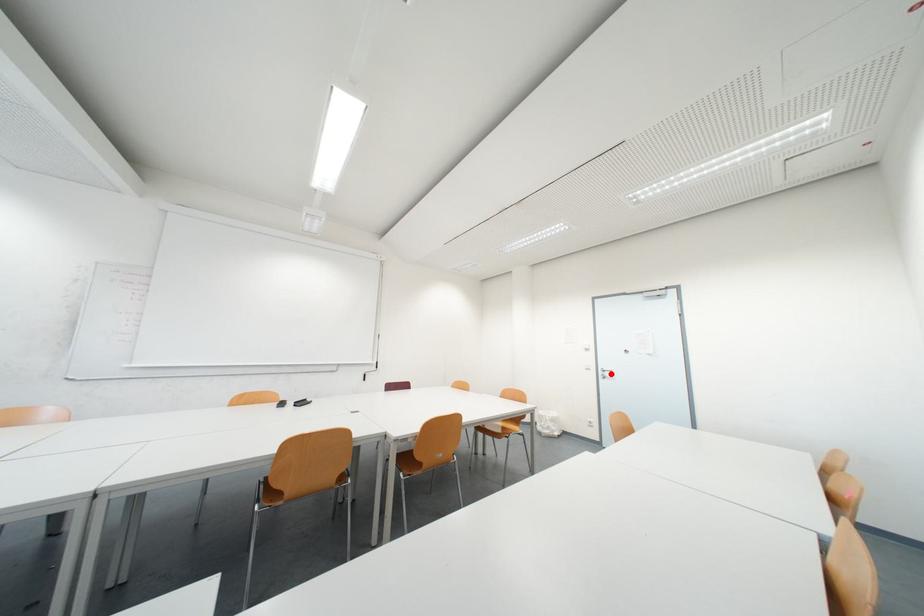
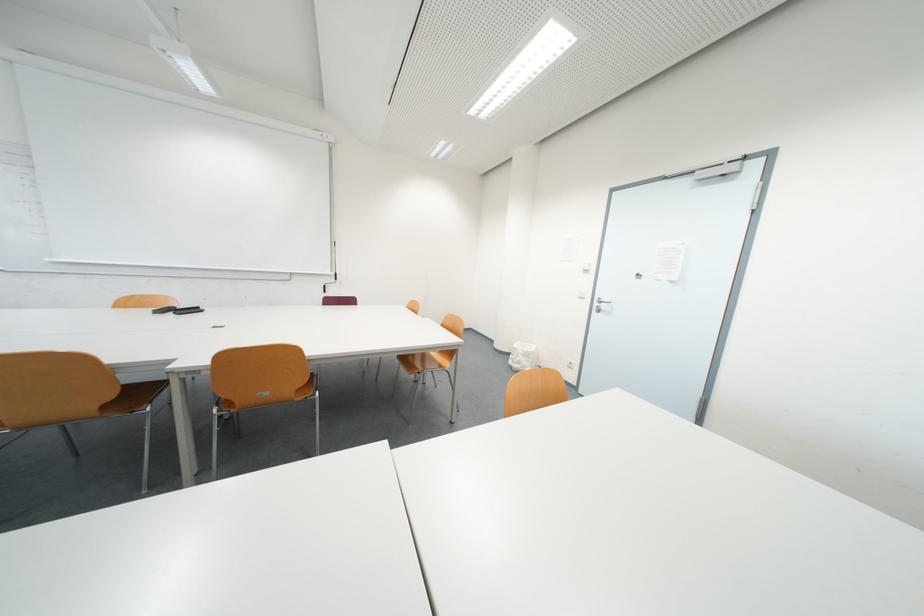
Question: I am providing you with two images of the same scene from different viewpoints. Given a red point in image1, look at the same physical point in image2. Is it:

Choices:
 (A) Closer to the viewpoint
 (B) Farther from the viewpoint

Answer: (A)